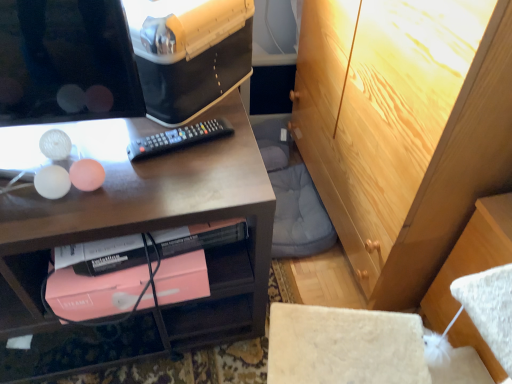
Identify the location of free space above pink matte book at lower center (from a real-world perspective). (137, 265).